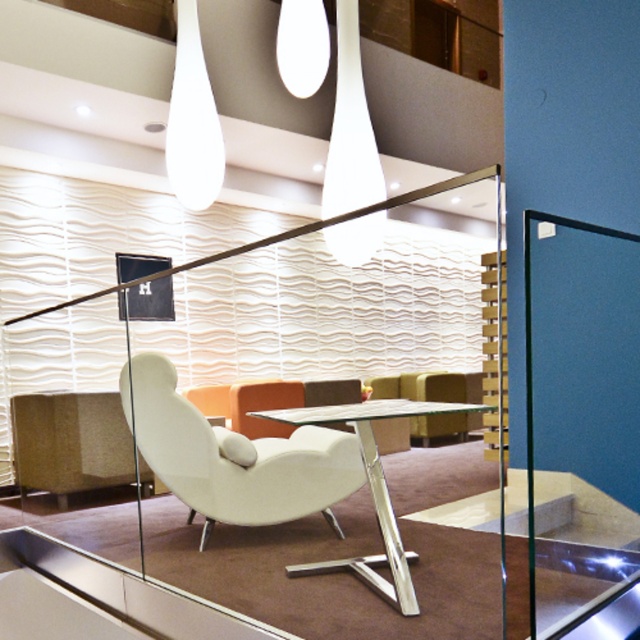
You are standing at the entrance of the lounge and want to move towards the white matte swivel chair at center. According to the coordinates provided, in which direction should you move from your current position to reach it?

The white matte swivel chair at center is located at coordinates point (234,456). Since you are at the entrance, which is typically positioned at the lower left corner of a space, you should move towards the upper right direction to reach the chair.

You are a delivery person carrying a package that requires a clear path of 1.5 meters to maneuver safely. You are standing next to the white matte swivel chair at center and need to reach the transparent glass door at right. Based on the scene, can you safely navigate to the door without obstacles?

The distance between the white matte swivel chair at center and the transparent glass door at right is 1.61 meters, which is greater than the required 1.5 meters. Therefore, you can safely maneuver the package through the path.

You are a delivery person trying to navigate through the lounge to deliver a package. You need to move from the entrance to the glass partition. There is a white matte swivel chair at center and a white glossy lamp at upper center in your path. Which object should you avoid to ensure you have enough space to pass through?

You should avoid the white glossy lamp at upper center because it occupies more space than the white matte swivel chair at center, so moving around the larger object would provide more clearance.